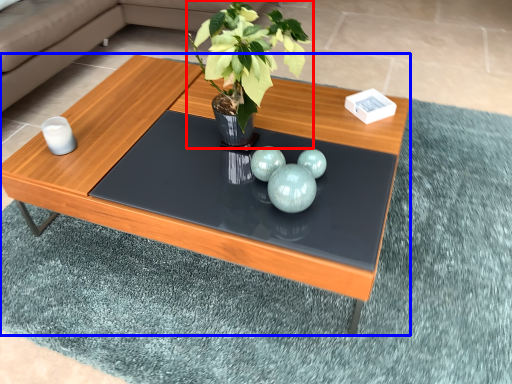
Question: Among these objects, which one is farthest to the camera, houseplant (highlighted by a red box) or coffee table (highlighted by a blue box)?

Choices:
 (A) houseplant
 (B) coffee table

Answer: (B)